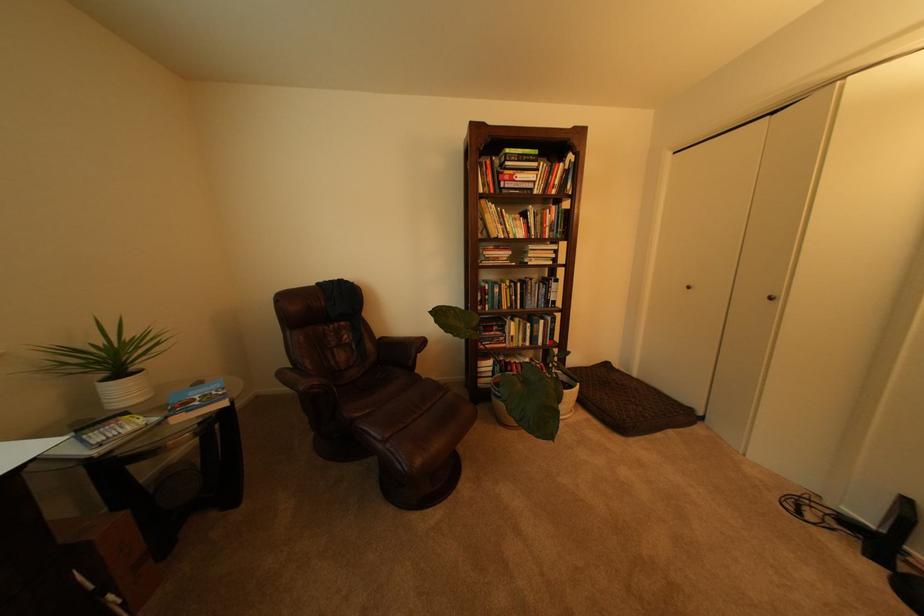
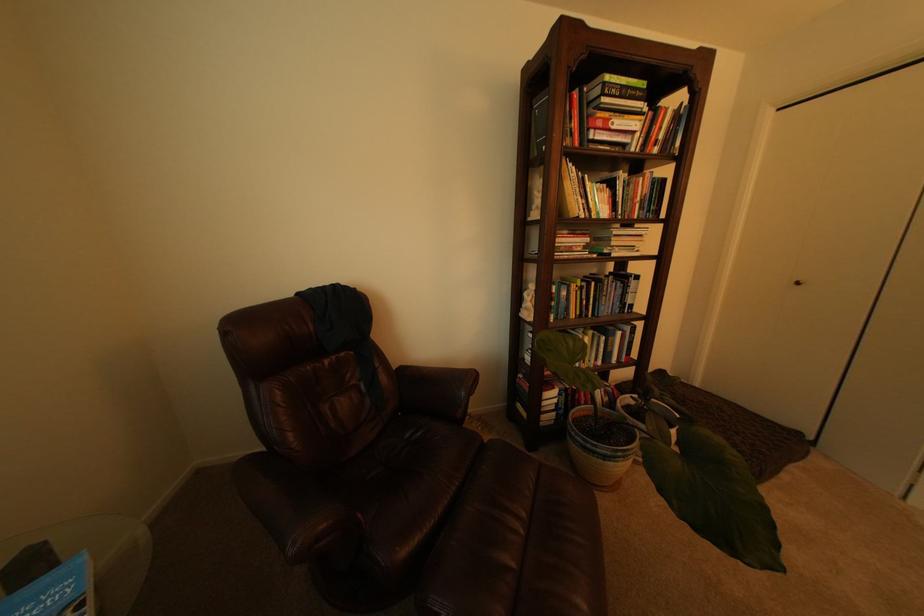
Question: The first image is from the beginning of the video and the second image is from the end. How did the camera likely rotate when shooting the video?

Choices:
 (A) Left
 (B) Right
 (C) Up
 (D) Down

Answer: (B)